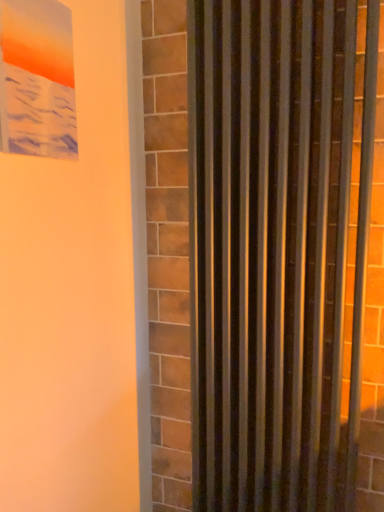
Question: From the image's perspective, is metallic silver curtain at right above matte plastic picture frame at upper left?

Choices:
 (A) yes
 (B) no

Answer: (B)

Question: Is metallic silver curtain at right turned away from matte plastic picture frame at upper left?

Choices:
 (A) no
 (B) yes

Answer: (A)

Question: Is metallic silver curtain at right to the right of matte plastic picture frame at upper left from the viewer's perspective?

Choices:
 (A) yes
 (B) no

Answer: (A)

Question: Can you confirm if metallic silver curtain at right is taller than matte plastic picture frame at upper left?

Choices:
 (A) yes
 (B) no

Answer: (A)

Question: Is metallic silver curtain at right in front of matte plastic picture frame at upper left?

Choices:
 (A) no
 (B) yes

Answer: (A)

Question: Is metallic silver curtain at right facing towards matte plastic picture frame at upper left?

Choices:
 (A) yes
 (B) no

Answer: (A)

Question: Does matte plastic picture frame at upper left lie behind metallic silver curtain at right?

Choices:
 (A) no
 (B) yes

Answer: (A)

Question: From a real-world perspective, is matte plastic picture frame at upper left physically below metallic silver curtain at right?

Choices:
 (A) no
 (B) yes

Answer: (A)

Question: Considering the relative sizes of matte plastic picture frame at upper left and metallic silver curtain at right in the image provided, is matte plastic picture frame at upper left smaller than metallic silver curtain at right?

Choices:
 (A) yes
 (B) no

Answer: (A)

Question: From the image's perspective, is matte plastic picture frame at upper left beneath metallic silver curtain at right?

Choices:
 (A) no
 (B) yes

Answer: (A)

Question: Is metallic silver curtain at right a part of matte plastic picture frame at upper left?

Choices:
 (A) yes
 (B) no

Answer: (B)

Question: Does matte plastic picture frame at upper left appear on the left side of metallic silver curtain at right?

Choices:
 (A) no
 (B) yes

Answer: (B)

Question: Visually, is metallic silver curtain at right positioned to the left or to the right of matte plastic picture frame at upper left?

Choices:
 (A) left
 (B) right

Answer: (B)